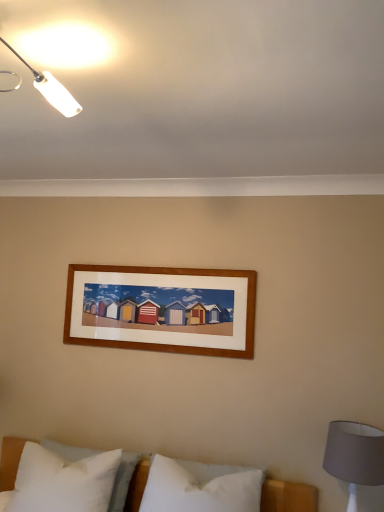
Question: Would you say white soft pillow at lower left, which is the 2th pillow from right to left, contains white plastic lamp at upper left?

Choices:
 (A) yes
 (B) no

Answer: (B)

Question: Is white soft pillow at lower left, arranged as the 1th pillow when viewed from the left, oriented towards white plastic lamp at upper left?

Choices:
 (A) no
 (B) yes

Answer: (A)

Question: Is white soft pillow at lower left, arranged as the 1th pillow when viewed from the left, taller than white plastic lamp at upper left?

Choices:
 (A) yes
 (B) no

Answer: (A)

Question: From the image's perspective, is white soft pillow at lower left, which is the 2th pillow from right to left, located beneath white plastic lamp at upper left?

Choices:
 (A) no
 (B) yes

Answer: (B)

Question: Is white soft pillow at lower left, which is the 2th pillow from right to left, in contact with white plastic lamp at upper left?

Choices:
 (A) no
 (B) yes

Answer: (A)

Question: Is white soft pillow at lower left, which is the 2th pillow from right to left, wider or thinner than white plastic lamp at upper left?

Choices:
 (A) wide
 (B) thin

Answer: (A)

Question: Choose the correct answer: Is white soft pillow at lower left, arranged as the 1th pillow when viewed from the left, inside white plastic lamp at upper left or outside it?

Choices:
 (A) outside
 (B) inside

Answer: (A)

Question: From their relative heights in the image, would you say white soft pillow at lower left, which is the 2th pillow from right to left, is taller or shorter than white plastic lamp at upper left?

Choices:
 (A) short
 (B) tall

Answer: (B)

Question: From the image's perspective, is white soft pillow at lower left, arranged as the 1th pillow when viewed from the left, above or below white plastic lamp at upper left?

Choices:
 (A) below
 (B) above

Answer: (A)

Question: From their relative heights in the image, would you say white soft pillow at center, arranged as the second pillow when viewed from the left, is taller or shorter than white soft pillow at lower left, which is the 2th pillow from right to left?

Choices:
 (A) tall
 (B) short

Answer: (B)

Question: Based on their positions, is white soft pillow at center, arranged as the second pillow when viewed from the left, located to the left or right of white soft pillow at lower left, which is the 2th pillow from right to left?

Choices:
 (A) right
 (B) left

Answer: (A)

Question: From a real-world perspective, relative to white soft pillow at lower left, arranged as the 1th pillow when viewed from the left, is white soft pillow at center, arranged as the second pillow when viewed from the left, vertically above or below?

Choices:
 (A) below
 (B) above

Answer: (B)

Question: From the image's perspective, is white soft pillow at center, arranged as the second pillow when viewed from the left, above or below white soft pillow at lower left, arranged as the 1th pillow when viewed from the left?

Choices:
 (A) above
 (B) below

Answer: (B)

Question: From a real-world perspective, is white soft pillow at center, arranged as the second pillow when viewed from the left, physically located above or below gray fabric lampshade at lower right?

Choices:
 (A) below
 (B) above

Answer: (A)

Question: Is white soft pillow at center, arranged as the second pillow when viewed from the left, taller or shorter than gray fabric lampshade at lower right?

Choices:
 (A) tall
 (B) short

Answer: (B)